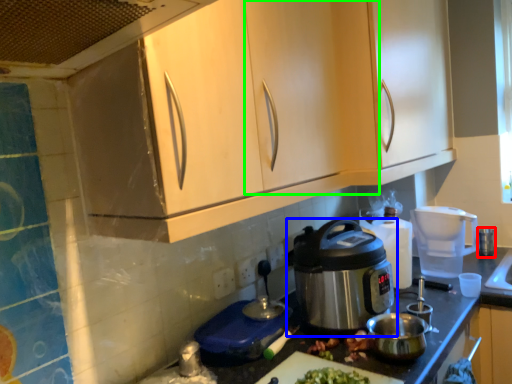
Question: Considering the real-world distances, which object is farthest from appliance (highlighted by a red box)? home appliance (highlighted by a blue box) or cabinetry (highlighted by a green box)?

Choices:
 (A) home appliance
 (B) cabinetry

Answer: (B)